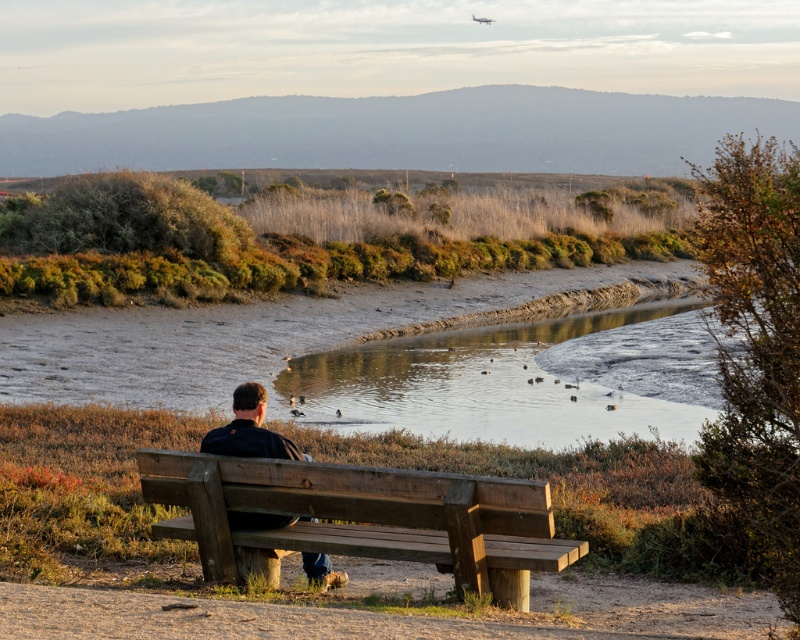
Question: Where is muddy water at center located in relation to wooden bench at center in the image?

Choices:
 (A) above
 (B) below

Answer: (A)

Question: Which point is farther to the camera?

Choices:
 (A) muddy water at center
 (B) dark brown leather jacket at center

Answer: (A)

Question: Where is muddy water at center located in relation to wooden bench at center in the image?

Choices:
 (A) below
 (B) above

Answer: (B)

Question: Estimate the real-world distances between objects in this image. Which object is farther from the muddy water at center?

Choices:
 (A) dark brown leather jacket at center
 (B) wooden bench at center

Answer: (A)

Question: Which is farther from the muddy water at center?

Choices:
 (A) dark brown leather jacket at center
 (B) wooden bench at center

Answer: (A)

Question: Does muddy water at center have a greater width compared to wooden bench at center?

Choices:
 (A) no
 (B) yes

Answer: (B)